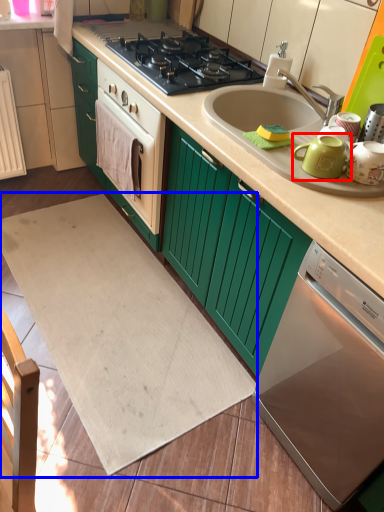
Question: Which point is further to the camera, teal (highlighted by a red box) or wide (highlighted by a blue box)?

Choices:
 (A) teal
 (B) wide

Answer: (B)